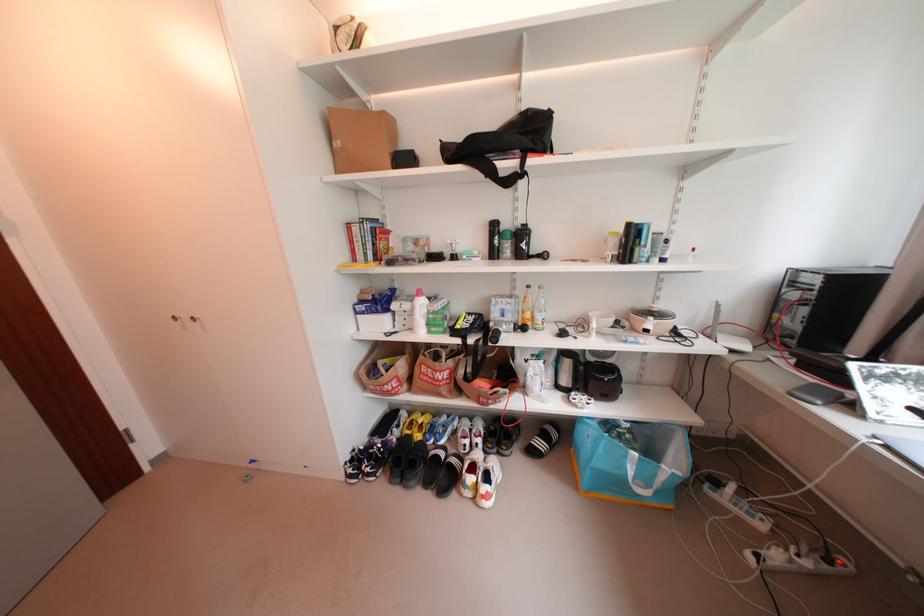
You are a GUI agent. You are given a task and a screenshot of the screen. Output one action in this format:
    pyautogui.click(x=<x>, y=<y>)
    Task: Click on the white remote control
    
    Given the screenshot: What is the action you would take?
    pyautogui.click(x=735, y=501)